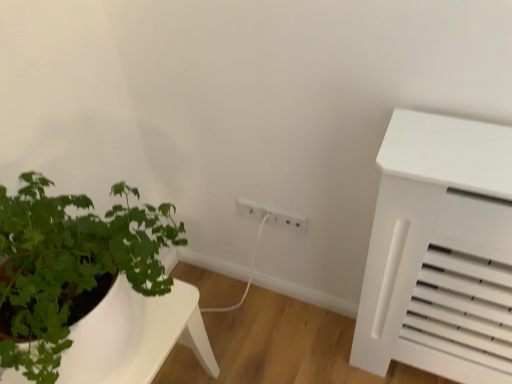
Question: Is white plastic electric outlet at center, acting as the 2th electric outlet starting from the left, aimed at white matte table at lower left?

Choices:
 (A) yes
 (B) no

Answer: (A)

Question: Does white plastic electric outlet at center, placed as the first electric outlet when sorted from right to left, appear on the right side of white matte table at lower left?

Choices:
 (A) no
 (B) yes

Answer: (B)

Question: Can you confirm if white plastic electric outlet at center, acting as the 2th electric outlet starting from the left, is thinner than white matte table at lower left?

Choices:
 (A) no
 (B) yes

Answer: (B)

Question: Could white matte table at lower left be considered to be inside white plastic electric outlet at center, acting as the 2th electric outlet starting from the left?

Choices:
 (A) yes
 (B) no

Answer: (B)

Question: Would you consider white plastic electric outlet at center, placed as the first electric outlet when sorted from right to left, to be distant from white matte table at lower left?

Choices:
 (A) no
 (B) yes

Answer: (A)

Question: From a real-world perspective, is white plastic electric outlet at center, placed as the first electric outlet when sorted from right to left, beneath white matte table at lower left?

Choices:
 (A) yes
 (B) no

Answer: (B)

Question: Can you confirm if white plastic electric outlet at center, acting as the 2th electric outlet starting from the left, is taller than white plastic electric outlet at center, which appears as the 2th electric outlet when viewed from the right?

Choices:
 (A) no
 (B) yes

Answer: (B)

Question: From a real-world perspective, does white plastic electric outlet at center, placed as the first electric outlet when sorted from right to left, sit lower than white plastic electric outlet at center, which appears as the 1th electric outlet when viewed from the left?

Choices:
 (A) yes
 (B) no

Answer: (A)

Question: From the image's perspective, is white plastic electric outlet at center, placed as the first electric outlet when sorted from right to left, below white plastic electric outlet at center, which appears as the 1th electric outlet when viewed from the left?

Choices:
 (A) yes
 (B) no

Answer: (B)

Question: Is white plastic electric outlet at center, acting as the 2th electric outlet starting from the left, wider than white plastic electric outlet at center, which appears as the 2th electric outlet when viewed from the right?

Choices:
 (A) yes
 (B) no

Answer: (A)

Question: From a real-world perspective, is white plastic electric outlet at center, placed as the first electric outlet when sorted from right to left, physically above white plastic electric outlet at center, which appears as the 1th electric outlet when viewed from the left?

Choices:
 (A) yes
 (B) no

Answer: (B)

Question: Does white plastic electric outlet at center, acting as the 2th electric outlet starting from the left, lie behind white plastic electric outlet at center, which appears as the 1th electric outlet when viewed from the left?

Choices:
 (A) yes
 (B) no

Answer: (B)

Question: Does white matte table at lower left appear on the right side of white plastic electric outlet at center, which appears as the 1th electric outlet when viewed from the left?

Choices:
 (A) yes
 (B) no

Answer: (B)